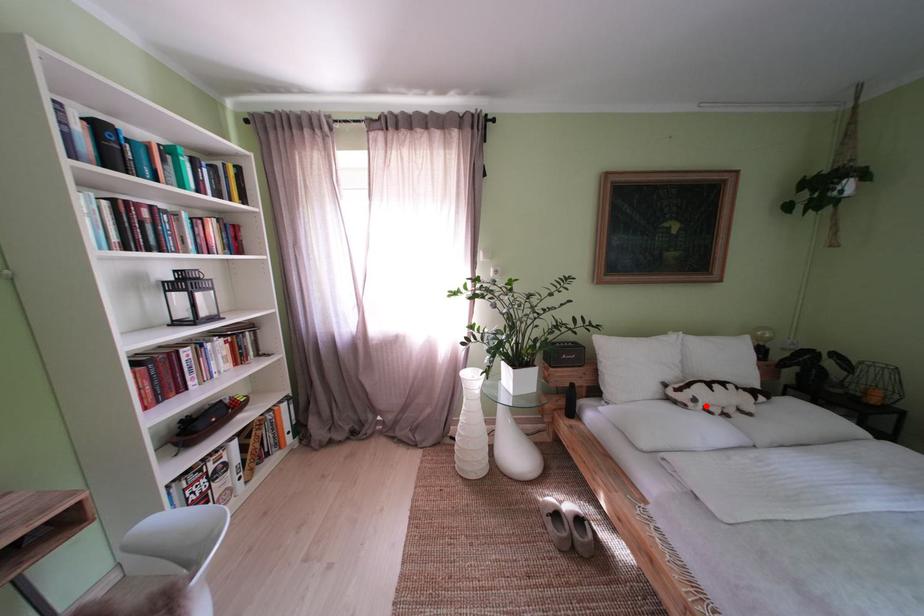
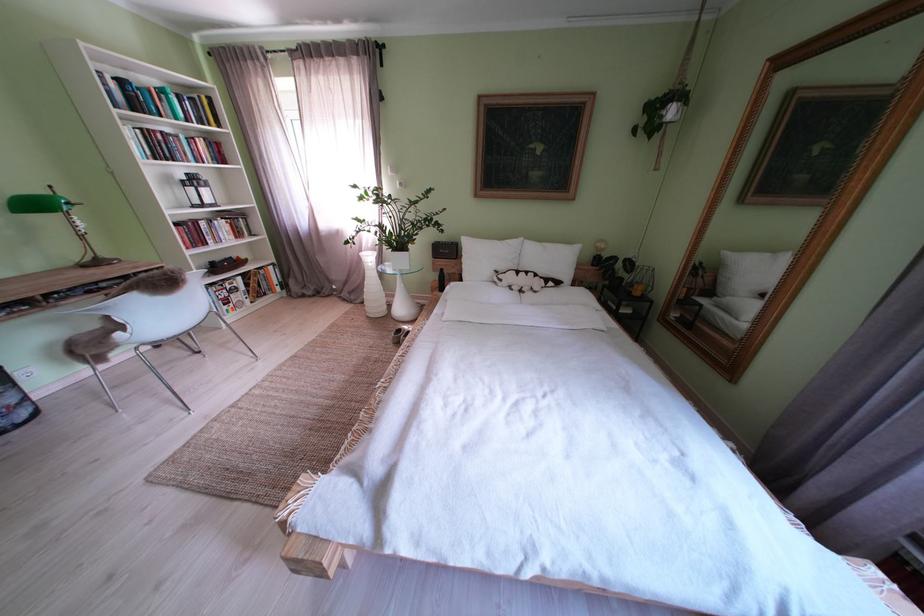
Where in the second image is the point corresponding to the highlighted location from the first image?

(512, 285)